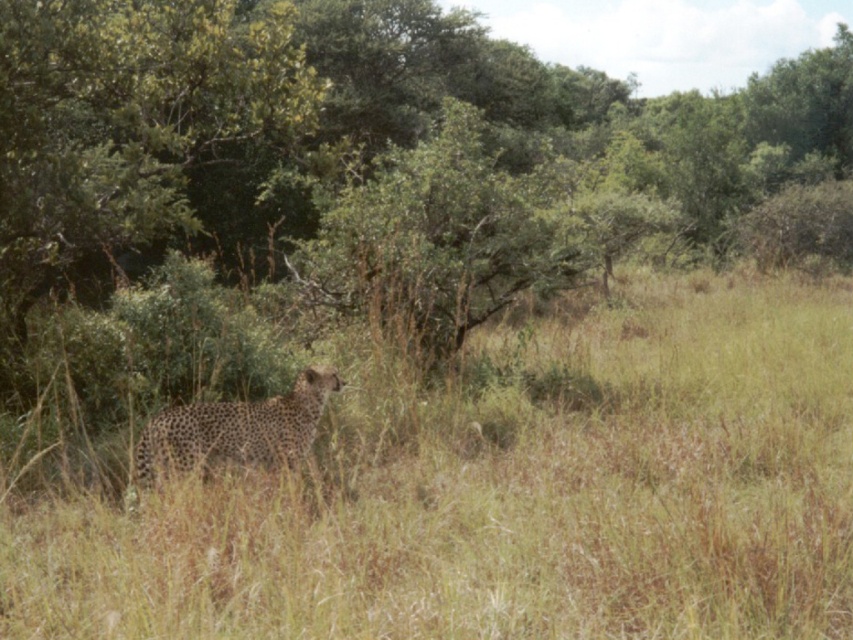
Who is more forward, (361, 481) or (67, 84)?

Point (361, 481) is more forward.

Can you confirm if brown dry grass at center is positioned below green leafy tree at center?

Indeed, brown dry grass at center is positioned under green leafy tree at center.

Does point (223, 564) lie behind point (96, 172)?

No, it is in front of (96, 172).

Find the location of a particular element. The height and width of the screenshot is (640, 853). brown dry grass at center is located at coordinates (508, 499).

Is brown dry grass at center taller than spotted fur cheetah at center?

Correct, brown dry grass at center is much taller as spotted fur cheetah at center.

Identify the location of brown dry grass at center. This screenshot has height=640, width=853. (508, 499).

Is green leafy tree at center to the right of spotted fur cheetah at center from the viewer's perspective?

Yes, green leafy tree at center is to the right of spotted fur cheetah at center.

Is green leafy tree at center above spotted fur cheetah at center?

Indeed, green leafy tree at center is positioned over spotted fur cheetah at center.

Describe the element at coordinates (315, 124) in the screenshot. I see `green leafy tree at center` at that location.

You are a GUI agent. You are given a task and a screenshot of the screen. Output one action in this format:
    pyautogui.click(x=<x>, y=<y>)
    Task: Click on the green leafy tree at center
    The width and height of the screenshot is (853, 640).
    Given the screenshot: What is the action you would take?
    pyautogui.click(x=315, y=124)